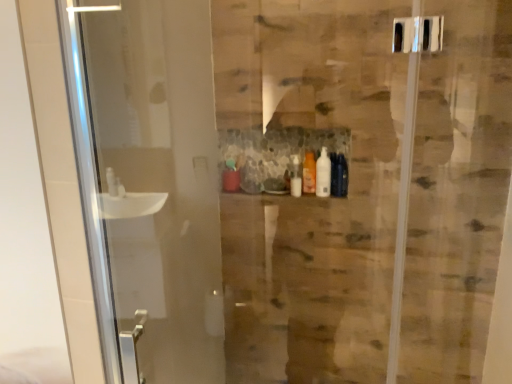
Question: Considering the positions of matte green bottle at center, the second toiletry in the right-to-left sequence, and translucent orange bottle at center, the first toiletry in the right-to-left sequence, in the image, is matte green bottle at center, the second toiletry in the right-to-left sequence, taller or shorter than translucent orange bottle at center, the first toiletry in the right-to-left sequence,?

Choices:
 (A) tall
 (B) short

Answer: (B)

Question: Relative to translucent orange bottle at center, the first toiletry in the right-to-left sequence, is matte green bottle at center, the second toiletry in the right-to-left sequence, in front or behind?

Choices:
 (A) behind
 (B) front

Answer: (A)

Question: Considering the positions of matte green bottle at center, the second toiletry in the right-to-left sequence, and translucent orange bottle at center, the first toiletry in the right-to-left sequence, in the image, is matte green bottle at center, the second toiletry in the right-to-left sequence, wider or thinner than translucent orange bottle at center, the first toiletry in the right-to-left sequence,?

Choices:
 (A) wide
 (B) thin

Answer: (A)

Question: Considering their positions, is translucent orange bottle at center, which ranks as the 2th toiletry in left-to-right order, located in front of or behind matte green bottle at center, positioned as the 1th toiletry in left-to-right order?

Choices:
 (A) front
 (B) behind

Answer: (A)

Question: From the image's perspective, relative to matte green bottle at center, positioned as the 1th toiletry in left-to-right order, is translucent orange bottle at center, which ranks as the 2th toiletry in left-to-right order, above or below?

Choices:
 (A) above
 (B) below

Answer: (A)

Question: Is translucent orange bottle at center, the first toiletry in the right-to-left sequence, to the left or to the right of matte green bottle at center, the second toiletry in the right-to-left sequence, in the image?

Choices:
 (A) right
 (B) left

Answer: (A)

Question: Does point (306, 170) appear closer or farther from the camera than point (231, 158)?

Choices:
 (A) farther
 (B) closer

Answer: (B)